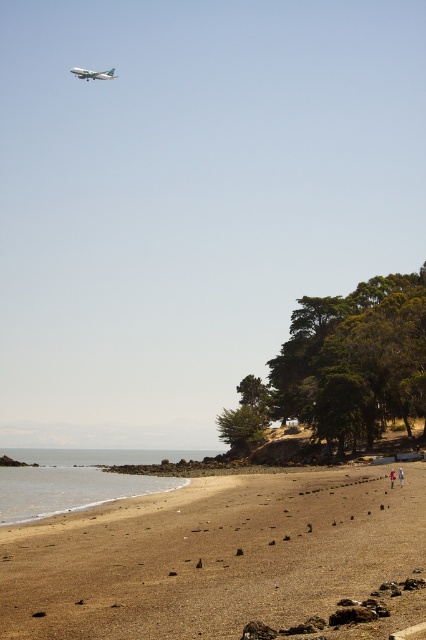
Question: Which object is closer to the camera taking this photo?

Choices:
 (A) clear water at lower left
 (B) brown sandy beach at lower center
 (C) white fabric person at lower right
 (D) silver metallic airplane at upper left

Answer: (B)

Question: Among these objects, which one is farthest from the camera?

Choices:
 (A) white fabric person at lower right
 (B) brown sandy beach at lower center
 (C) silver metallic airplane at upper left

Answer: (C)

Question: Does brown sandy beach at lower center lie behind silver metallic airplane at upper left?

Choices:
 (A) no
 (B) yes

Answer: (A)

Question: Is clear water at lower left in front of silver metallic airplane at upper left?

Choices:
 (A) no
 (B) yes

Answer: (B)

Question: Among these points, which one is farthest from the camera?

Choices:
 (A) (86, 72)
 (B) (399, 483)
 (C) (391, 472)

Answer: (A)

Question: Can you confirm if clear water at lower left is bigger than silver metallic airplane at upper left?

Choices:
 (A) yes
 (B) no

Answer: (A)